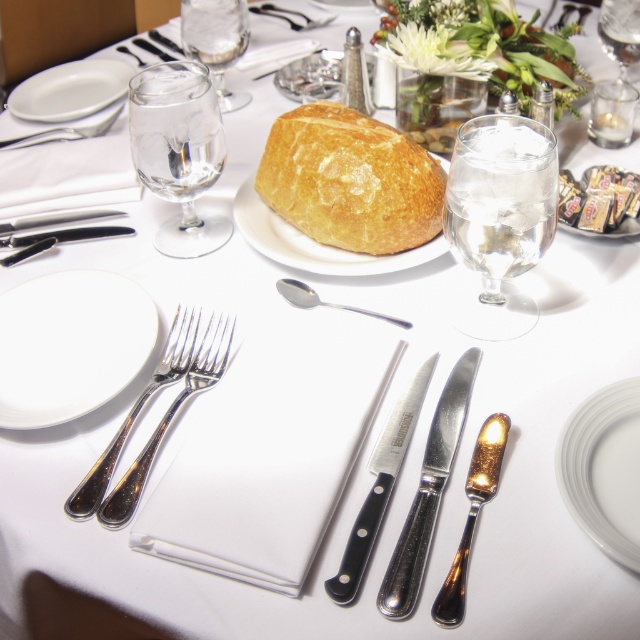
You are a guest at this formal dinner and want to reach for the gold plated butter knife at center without knocking over the clear glass wine glass at upper left. Based on their positions, which object is closer to you?

The gold plated butter knife at center is closer to you since the clear glass wine glass at upper left is located above it, meaning the butter knife is positioned lower and thus nearer in the arrangement.

You are a server at a restaurant and need to place a 18 inch long platter between the clear glass wine glass at upper right and the white ceramic plate at center. Will there be enough space?

The distance between the clear glass wine glass at upper right and the white ceramic plate at center is 21.17 inches. Since the platter is 18 inches long, there is sufficient space to place it between them.

You are a server at a formal dinner. You need to place a 24 inch long platter between the polished silver knife at center and the clear glass wine glass at upper left. Can you fit it there?

The distance between the polished silver knife at center and the clear glass wine glass at upper left is 24.80 inches. Since the platter is 24 inches long, it can fit in the space between them.